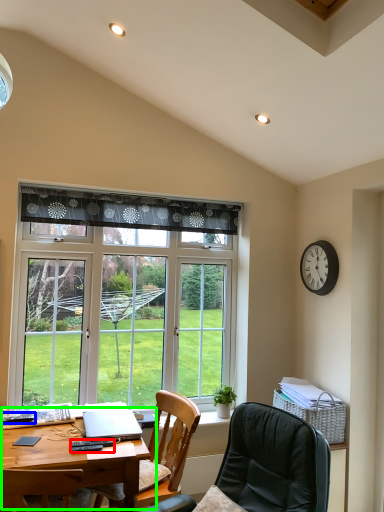
Question: Which is nearer to the remote control (highlighted by a red box)? remote control (highlighted by a blue box) or desk (highlighted by a green box).

Choices:
 (A) remote control
 (B) desk

Answer: (B)